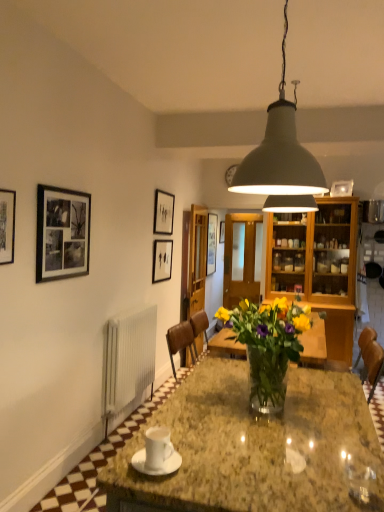
Question: Which direction should I rotate to look at matte white picture frame at upper center, marked as the 4th picture frame in a front-to-back arrangement, — up or down?

Choices:
 (A) up
 (B) down

Answer: (A)

Question: Does clear glass vase at center lie behind matte gray lampshade at upper center?

Choices:
 (A) yes
 (B) no

Answer: (A)

Question: Does clear glass vase at center appear on the right side of matte gray lampshade at upper center?

Choices:
 (A) no
 (B) yes

Answer: (A)

Question: From a real-world perspective, is clear glass vase at center located beneath matte gray lampshade at upper center?

Choices:
 (A) no
 (B) yes

Answer: (B)

Question: From the image's perspective, is clear glass vase at center below matte gray lampshade at upper center?

Choices:
 (A) yes
 (B) no

Answer: (A)

Question: Is clear glass vase at center not close to matte gray lampshade at upper center?

Choices:
 (A) no
 (B) yes

Answer: (A)

Question: Is clear glass vase at center at the left side of matte gray lampshade at upper center?

Choices:
 (A) yes
 (B) no

Answer: (A)

Question: From the image's perspective, does matte white picture frame at upper center, arranged as the fourth picture frame when viewed from the left, appear lower than black matte picture frame at upper left, positioned as the fourth picture frame in right-to-left order?

Choices:
 (A) no
 (B) yes

Answer: (A)

Question: From the image's perspective, is matte white picture frame at upper center, which is the first picture frame from back to front, on top of black matte picture frame at upper left, arranged as the first picture frame when viewed from the left?

Choices:
 (A) no
 (B) yes

Answer: (B)

Question: Considering the relative sizes of matte white picture frame at upper center, which is the first picture frame from back to front, and black matte picture frame at upper left, positioned as the fourth picture frame in right-to-left order, in the image provided, is matte white picture frame at upper center, which is the first picture frame from back to front, bigger than black matte picture frame at upper left, positioned as the fourth picture frame in right-to-left order,?

Choices:
 (A) no
 (B) yes

Answer: (A)

Question: Considering the relative sizes of matte white picture frame at upper center, which is the first picture frame from back to front, and black matte picture frame at upper left, which is counted as the 1th picture frame, starting from the front, in the image provided, is matte white picture frame at upper center, which is the first picture frame from back to front, taller than black matte picture frame at upper left, which is counted as the 1th picture frame, starting from the front,?

Choices:
 (A) no
 (B) yes

Answer: (A)

Question: Is matte white picture frame at upper center, which is the first picture frame from back to front, looking in the opposite direction of black matte picture frame at upper left, positioned as the fourth picture frame in right-to-left order?

Choices:
 (A) yes
 (B) no

Answer: (B)

Question: Is matte white picture frame at upper center, which is the first picture frame from back to front, thinner than black matte picture frame at upper left, which is counted as the 1th picture frame, starting from the front?

Choices:
 (A) yes
 (B) no

Answer: (B)

Question: Are matte black picture frame at upper center, the 2th picture frame in the right-to-left sequence, and black matte picture frame at upper left, arranged as the first picture frame when viewed from the left, located far from each other?

Choices:
 (A) no
 (B) yes

Answer: (B)